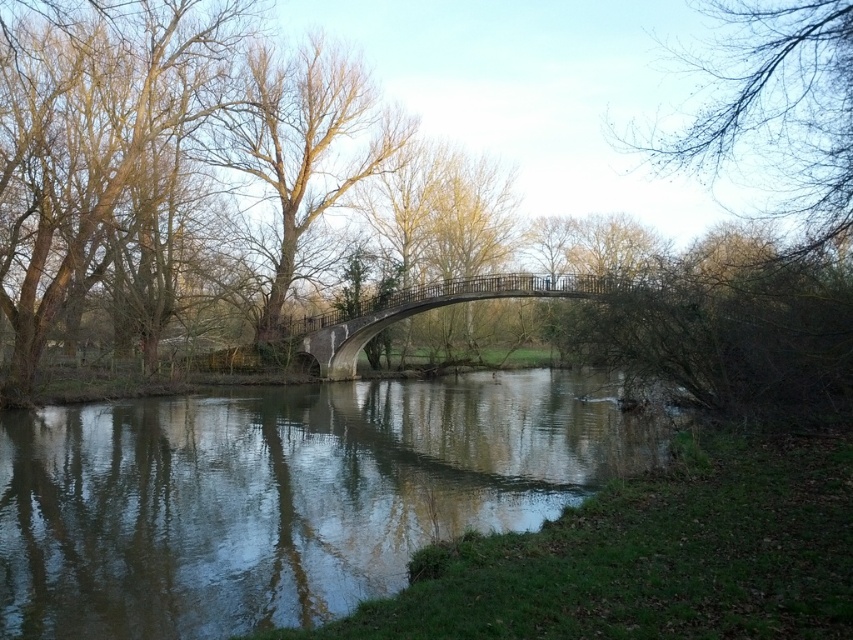
Question: Is smooth reflective water at center behind bare wood tree at center?

Choices:
 (A) no
 (B) yes

Answer: (A)

Question: Estimate the real-world distances between objects in this image. Which object is farther from the bare branches at upper right?

Choices:
 (A) stone gray bridge at center
 (B) smooth reflective water at center
 (C) bare wood tree at center
 (D) brown leafless tree at center

Answer: (C)

Question: Does smooth reflective water at center appear over bare branches at upper right?

Choices:
 (A) no
 (B) yes

Answer: (A)

Question: From the image, what is the correct spatial relationship of smooth reflective water at center in relation to bare branches at upper right?

Choices:
 (A) below
 (B) above

Answer: (A)

Question: Which point is closer to the camera?

Choices:
 (A) (x=587, y=278)
 (B) (x=265, y=129)
 (C) (x=560, y=424)
 (D) (x=769, y=86)

Answer: (D)

Question: Which point is farther to the camera?

Choices:
 (A) (283, 170)
 (B) (262, 221)

Answer: (A)